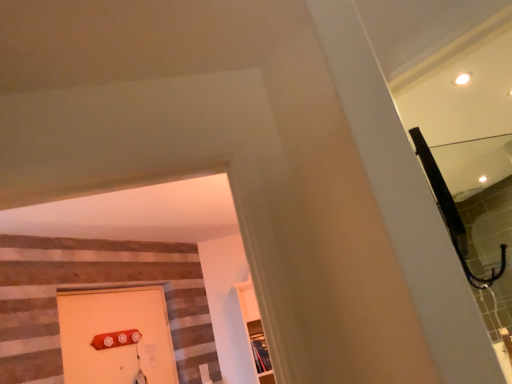
Question: Is matte orange door at lower left at the back of wooden shelf at center?

Choices:
 (A) yes
 (B) no

Answer: (B)

Question: From a real-world perspective, is wooden shelf at center on matte orange door at lower left?

Choices:
 (A) no
 (B) yes

Answer: (A)

Question: Could you tell me if wooden shelf at center is facing matte orange door at lower left?

Choices:
 (A) yes
 (B) no

Answer: (B)

Question: Does wooden shelf at center have a larger size compared to matte orange door at lower left?

Choices:
 (A) no
 (B) yes

Answer: (A)

Question: Is wooden shelf at center to the right of matte orange door at lower left from the viewer's perspective?

Choices:
 (A) yes
 (B) no

Answer: (A)

Question: Is matte orange door at lower left bigger or smaller than clear glass mirror at upper right?

Choices:
 (A) small
 (B) big

Answer: (B)

Question: Is matte orange door at lower left taller or shorter than clear glass mirror at upper right?

Choices:
 (A) tall
 (B) short

Answer: (A)

Question: Is point (88, 357) closer or farther from the camera than point (506, 251)?

Choices:
 (A) farther
 (B) closer

Answer: (B)

Question: From the image's perspective, relative to clear glass mirror at upper right, is matte orange door at lower left above or below?

Choices:
 (A) below
 (B) above

Answer: (A)

Question: Would you say clear glass mirror at upper right is to the left or to the right of matte orange door at lower left in the picture?

Choices:
 (A) right
 (B) left

Answer: (A)

Question: In terms of width, does clear glass mirror at upper right look wider or thinner when compared to matte orange door at lower left?

Choices:
 (A) wide
 (B) thin

Answer: (B)

Question: Does point (484, 306) appear closer or farther from the camera than point (86, 354)?

Choices:
 (A) closer
 (B) farther

Answer: (A)

Question: Considering their positions, is clear glass mirror at upper right located in front of or behind matte orange door at lower left?

Choices:
 (A) behind
 (B) front

Answer: (B)

Question: From their relative heights in the image, would you say clear glass mirror at upper right is taller or shorter than wooden shelf at center?

Choices:
 (A) tall
 (B) short

Answer: (B)

Question: From the image's perspective, relative to wooden shelf at center, is clear glass mirror at upper right above or below?

Choices:
 (A) below
 (B) above

Answer: (B)